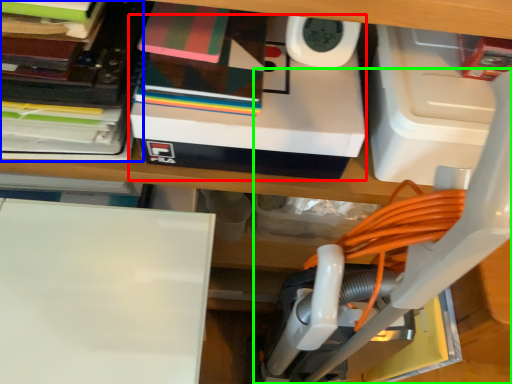
Question: Which object is positioned farthest from box (highlighted by a red box)? Select from book (highlighted by a blue box) and vacuum (highlighted by a green box).

Choices:
 (A) book
 (B) vacuum

Answer: (B)